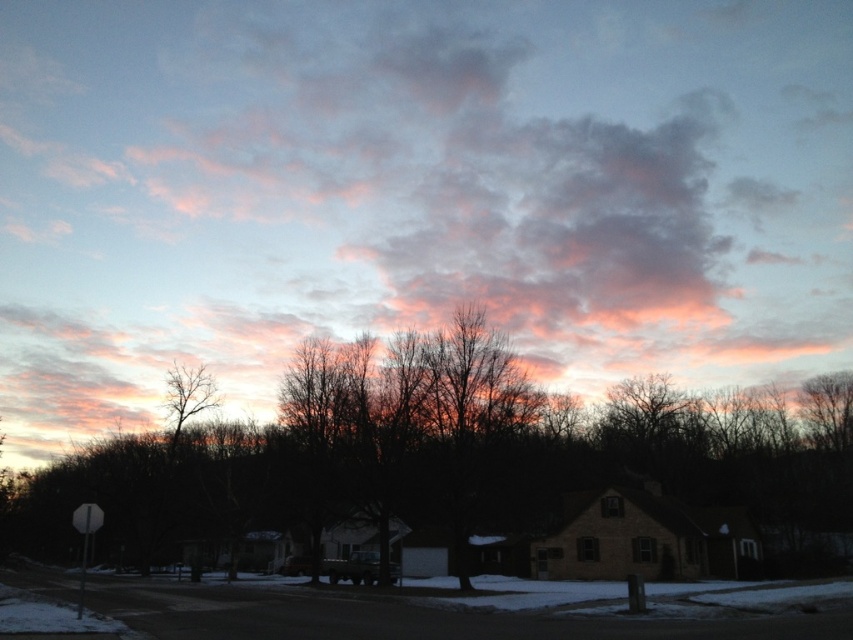
Question: Is pink fluffy cloud at upper center further to camera compared to bare branches at left?

Choices:
 (A) yes
 (B) no

Answer: (A)

Question: Does pink fluffy cloud at upper center appear on the left side of silhouette bare tree at center?

Choices:
 (A) no
 (B) yes

Answer: (B)

Question: Considering the real-world distances, which object is closest to the bare branches at left?

Choices:
 (A) pink fluffy cloud at upper center
 (B) silhouette bare tree at center

Answer: (B)

Question: Which object is positioned farthest from the silhouette bare tree at center?

Choices:
 (A) bare branches at left
 (B) pink fluffy cloud at upper center

Answer: (B)

Question: Is silhouette bare tree at center smaller than bare branches at left?

Choices:
 (A) no
 (B) yes

Answer: (A)

Question: Which of the following is the closest to the observer?

Choices:
 (A) bare branches at left
 (B) pink fluffy cloud at upper center

Answer: (A)